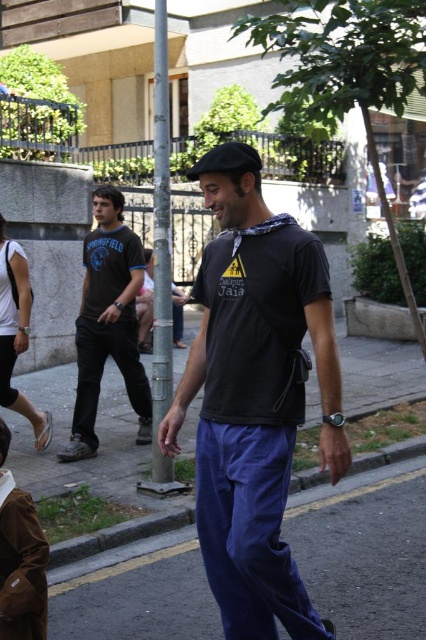
Question: Considering the real-world distances, which object is farthest from the blue fabric pants at lower center?

Choices:
 (A) black cotton t-shirt at center
 (B) black fabric baseball hat at center

Answer: (B)

Question: Which of the following is the farthest from the observer?

Choices:
 (A) black fabric baseball hat at center
 (B) black cotton t-shirt at center

Answer: (A)

Question: Does black cotton t-shirt at center appear on the right side of black fabric baseball hat at center?

Choices:
 (A) yes
 (B) no

Answer: (A)

Question: Is the position of black cotton t-shirt at center less distant than that of black fabric baseball hat at center?

Choices:
 (A) no
 (B) yes

Answer: (B)

Question: Is black cotton t-shirt at center to the right of matte black t-shirt at center from the viewer's perspective?

Choices:
 (A) no
 (B) yes

Answer: (B)

Question: Which is nearer to the blue fabric pants at lower center?

Choices:
 (A) black fabric baseball hat at center
 (B) matte black t-shirt at center
 (C) black cotton t-shirt at center

Answer: (C)